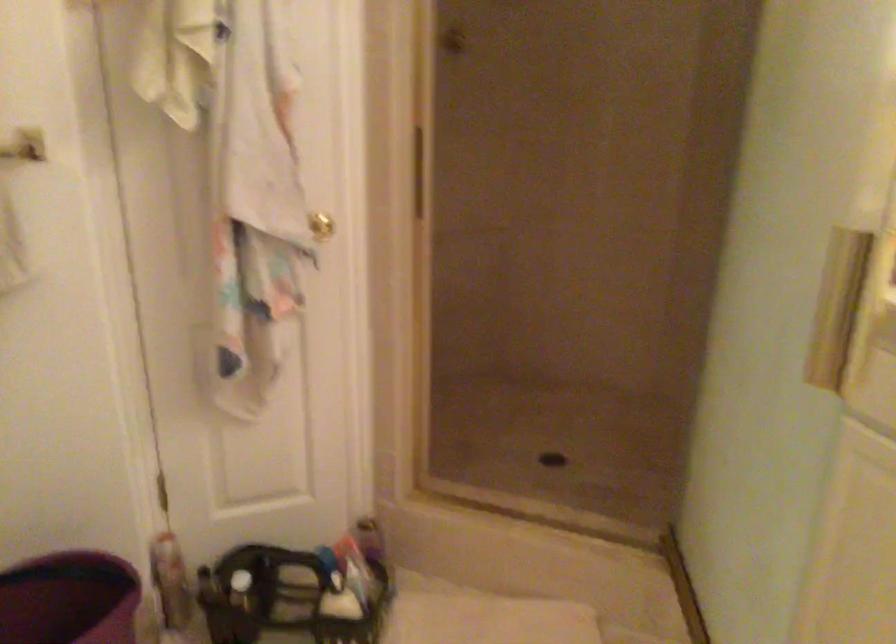
The width and height of the screenshot is (896, 644). I want to click on gold door knob, so click(x=321, y=225).